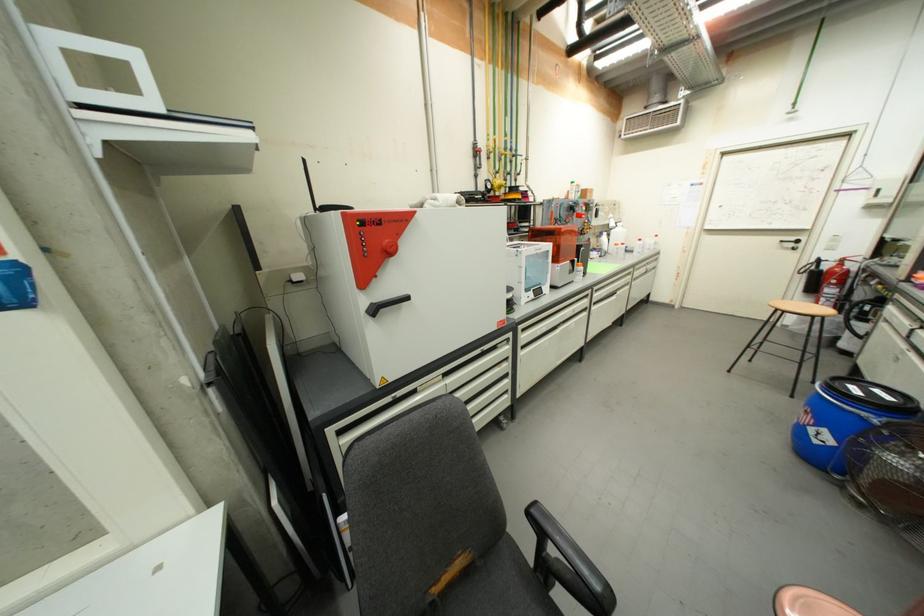
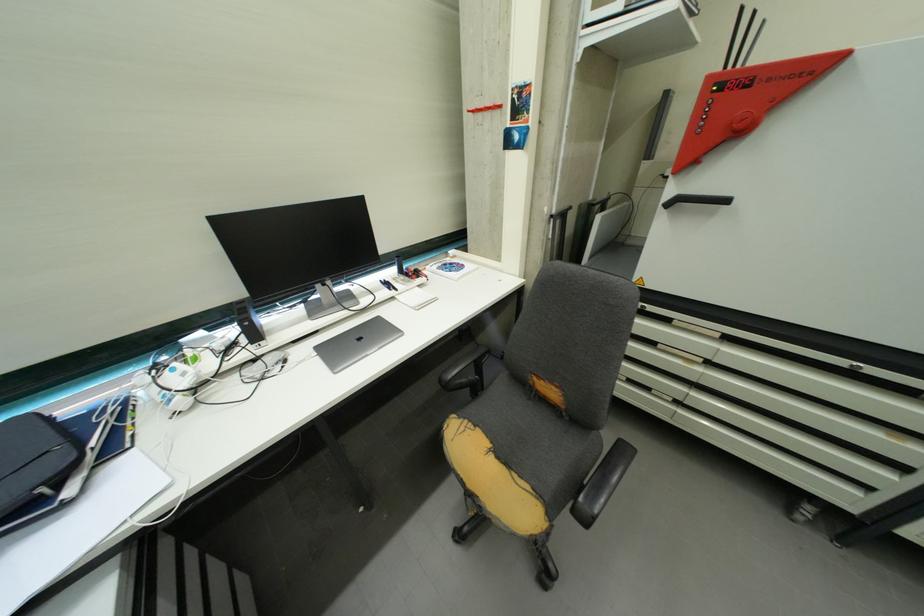
Locate, in the second image, the point that corresponds to (386,222) in the first image.

(759, 81)